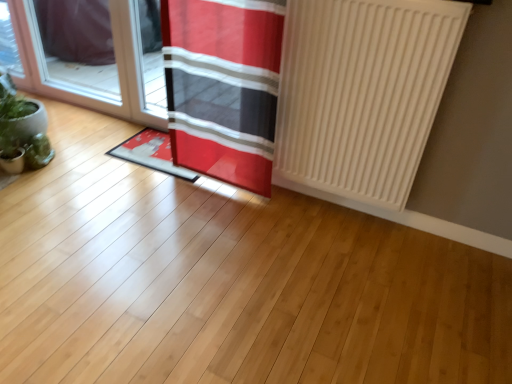
Question: From a real-world perspective, is red fabric curtain at center above or below green matte plant at left?

Choices:
 (A) below
 (B) above

Answer: (B)

Question: Looking at their shapes, would you say red fabric curtain at center is wider or thinner than green matte plant at left?

Choices:
 (A) thin
 (B) wide

Answer: (B)

Question: Considering the real-world distances, which object is closest to the transparent glass door at left?

Choices:
 (A) red fabric doormat at center
 (B) white matte radiator at right
 (C) green matte plant at left
 (D) green matte plant at left
 (E) red fabric curtain at center

Answer: (A)

Question: Estimate the real-world distances between objects in this image. Which object is farther from the transparent glass door at left?

Choices:
 (A) white matte radiator at right
 (B) red fabric doormat at center
 (C) red fabric curtain at center
 (D) green matte plant at left
 (E) green matte plant at left

Answer: (A)